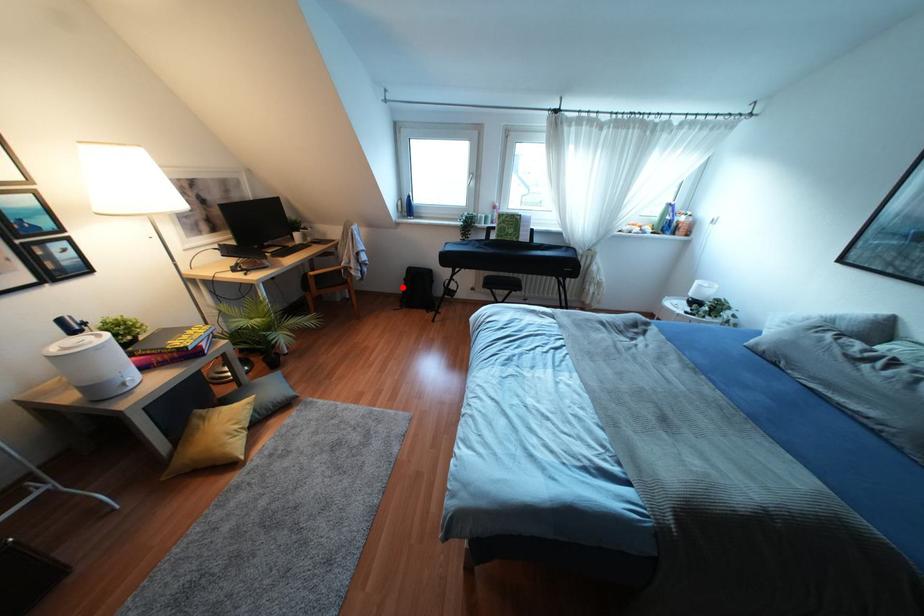
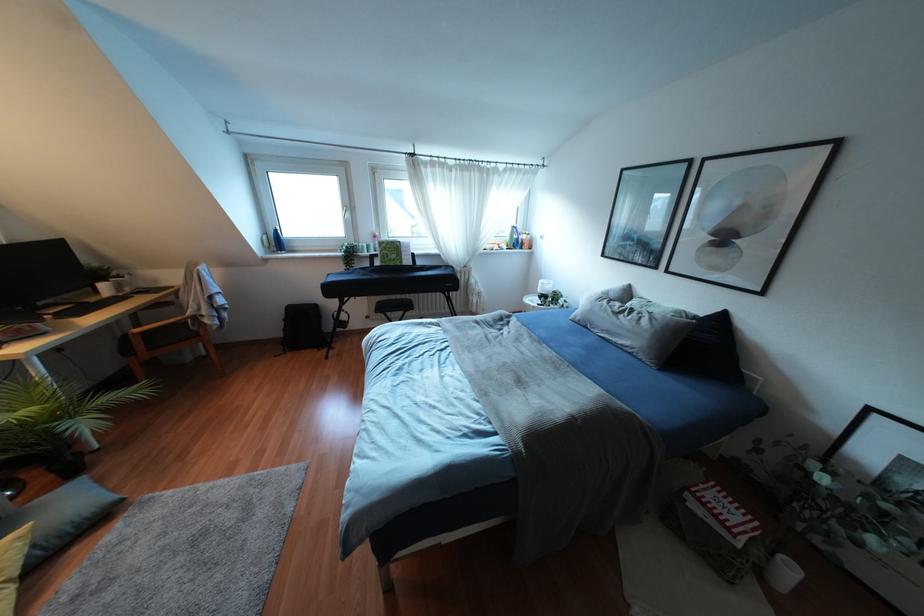
The point at the highlighted location is marked in the first image. Where is the corresponding point in the second image?

(284, 329)